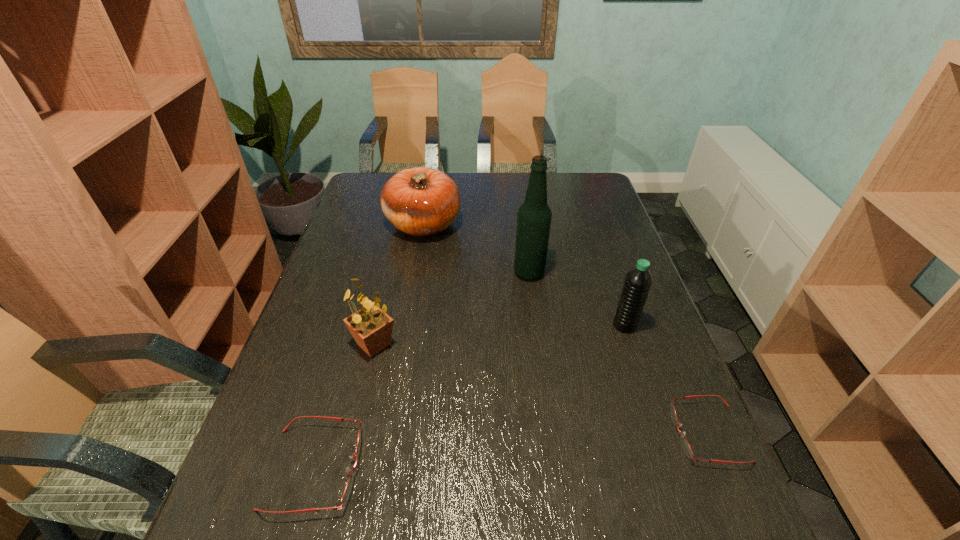
The width and height of the screenshot is (960, 540). What are the coordinates of `object that can be found as the closest to the taller spectacles` in the screenshot? It's located at pyautogui.click(x=371, y=327).

Identify the location of vacant position in the image that satisfies the following two spatial constraints: 1. on the front side of the farthest object; 2. on the lenses of the second shortest object. (381, 468).

This screenshot has height=540, width=960. What are the coordinates of `vacant space that satisfies the following two spatial constraints: 1. on the front side of the second farthest object; 2. on the lenses of the second shortest object` in the screenshot? It's located at (555, 468).